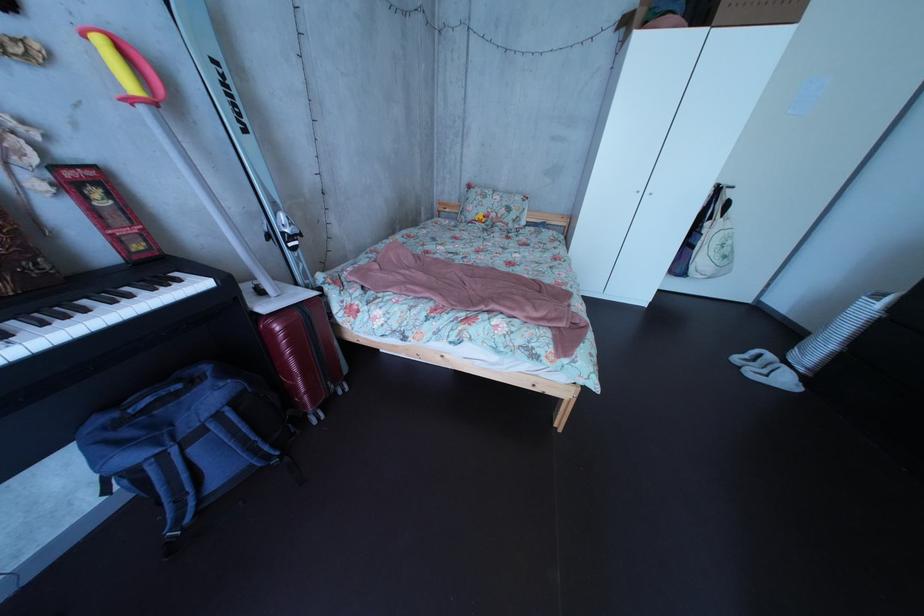
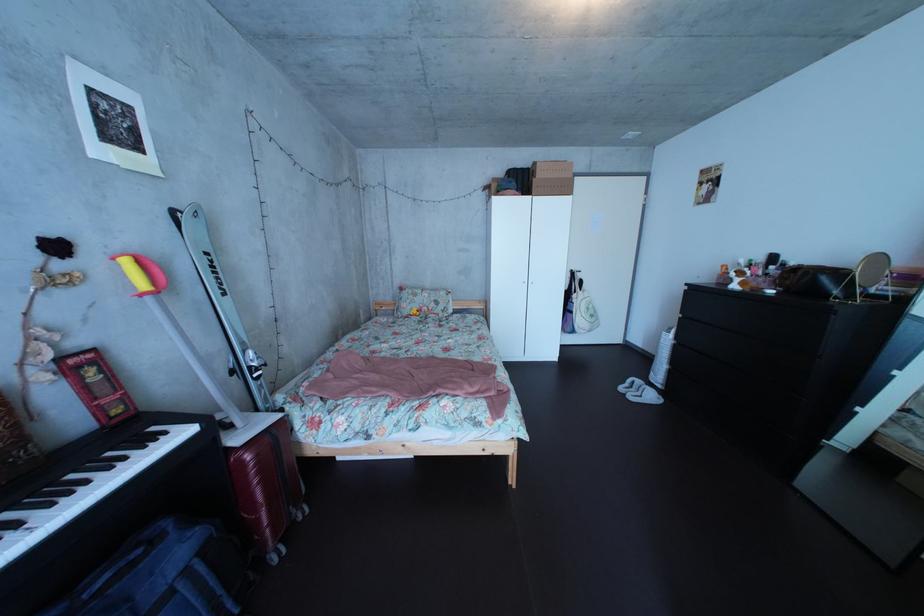
Question: In a continuous first-person perspective shot, in which direction is the camera moving?

Choices:
 (A) Left
 (B) Right
 (C) Forward
 (D) Backward

Answer: (D)